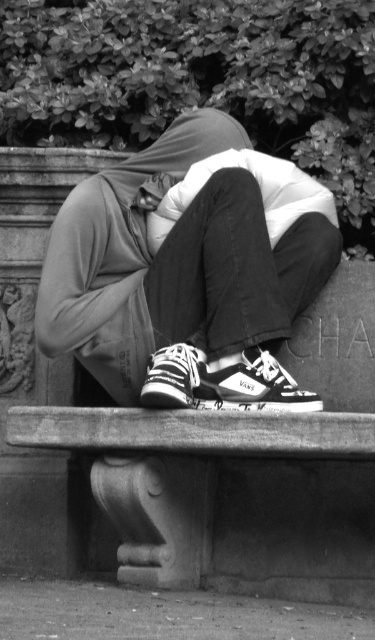
Who is taller, matte black hoodie at center or smooth stone bench at center?

Standing taller between the two is matte black hoodie at center.

Does matte black hoodie at center have a smaller size compared to smooth stone bench at center?

No, matte black hoodie at center is not smaller than smooth stone bench at center.

Describe the element at coordinates (189, 269) in the screenshot. This screenshot has height=640, width=375. I see `matte black hoodie at center` at that location.

At what (x,y) coordinates should I click in order to perform the action: click on matte black hoodie at center. Please return your answer as a coordinate pair (x, y). The width and height of the screenshot is (375, 640). Looking at the image, I should click on (189, 269).